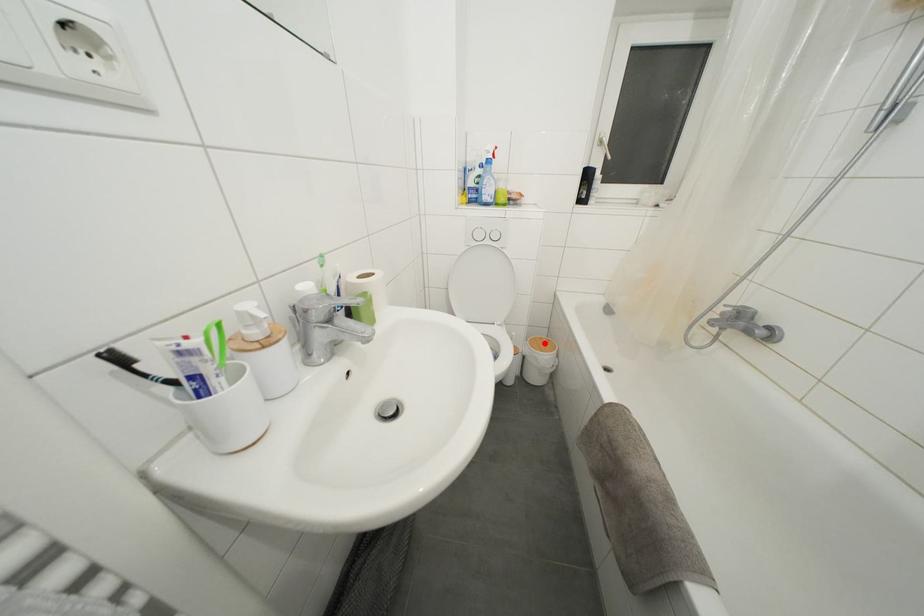
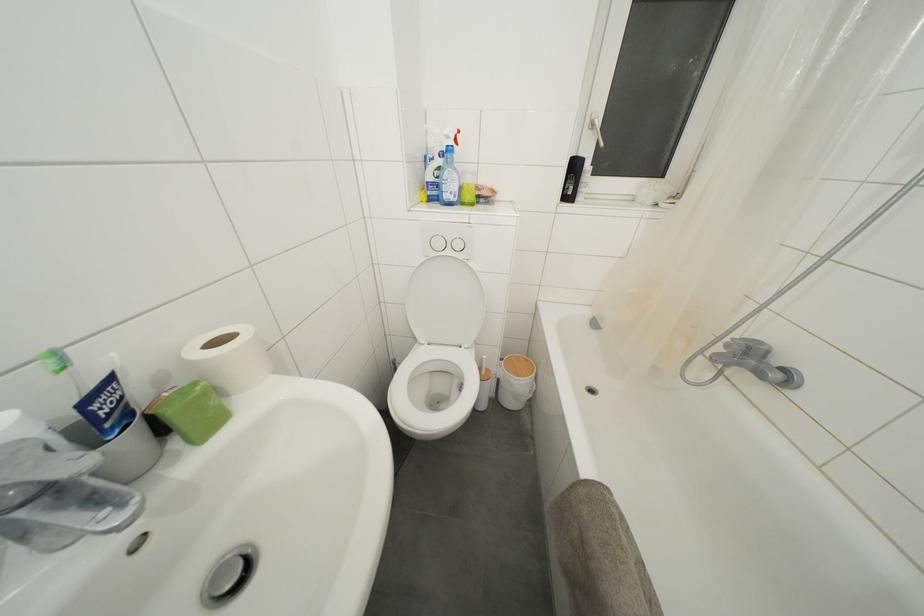
Question: I am providing you with two images of the same scene from different viewpoints. A red point is shown in image1. For the corresponding object point in image2, is it positioned nearer or farther from the camera?

Choices:
 (A) Nearer
 (B) Farther

Answer: (B)